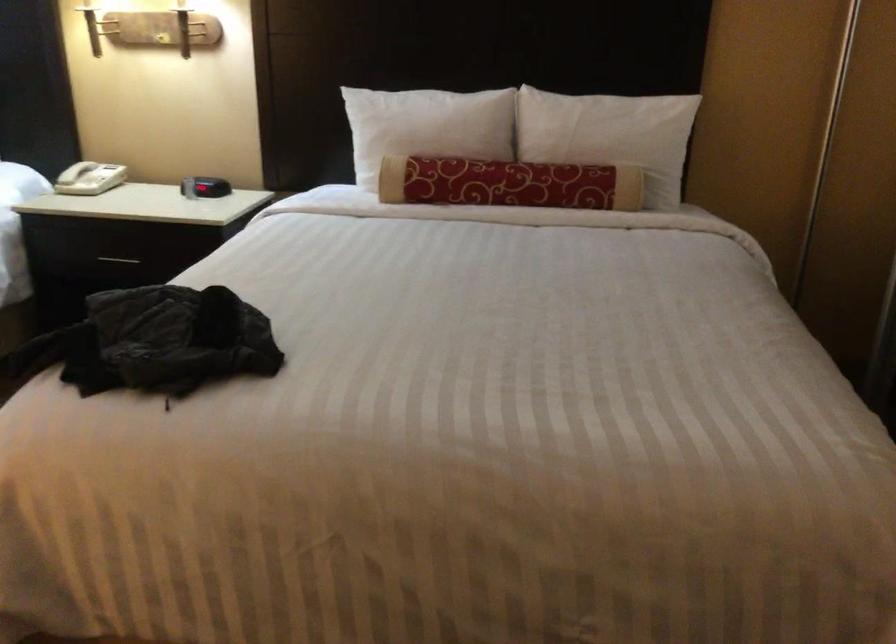
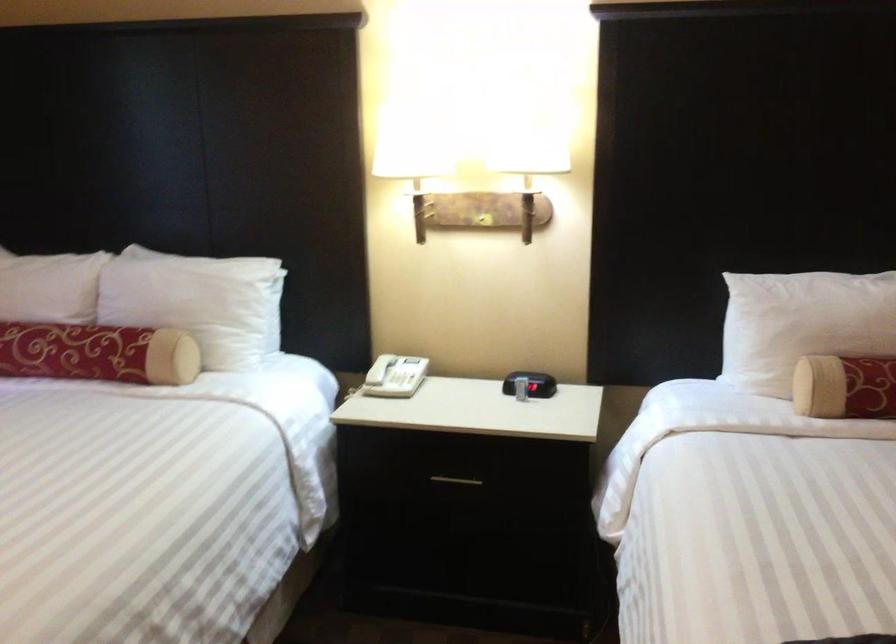
Find the pixel in the second image that matches the point at 397,181 in the first image.

(845, 386)